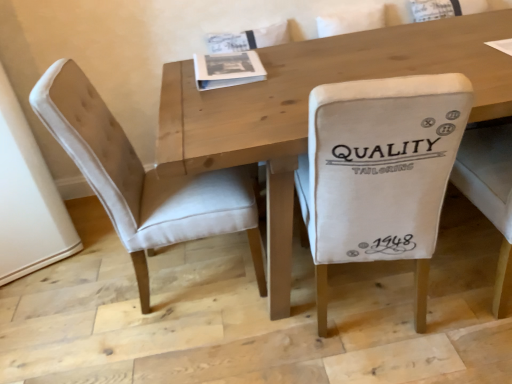
Where is `free space in front of beige fabric chair at left, the 1th chair in the left-to-right sequence`? free space in front of beige fabric chair at left, the 1th chair in the left-to-right sequence is located at coordinates (200, 343).